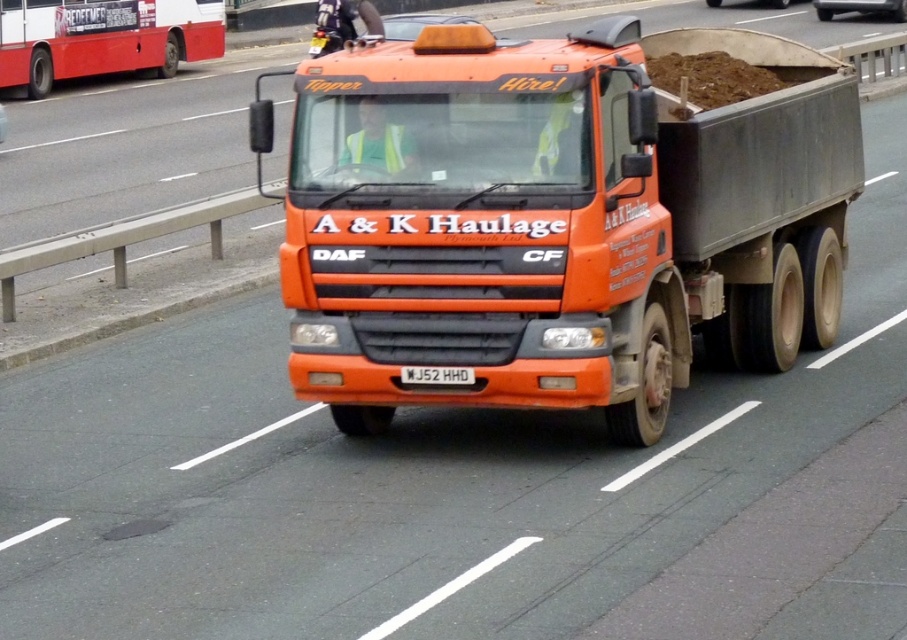
Question: Can you confirm if orange matte truck at center is positioned above white plastic license plate at center?

Choices:
 (A) no
 (B) yes

Answer: (B)

Question: Which of the following is the farthest from the observer?

Choices:
 (A) (467, 380)
 (B) (403, 160)

Answer: (B)

Question: Which point is closer to the camera?

Choices:
 (A) orange matte truck at center
 (B) white plastic license plate at center

Answer: (B)

Question: Does orange matte truck at center have a lesser width compared to white plastic license plate at center?

Choices:
 (A) no
 (B) yes

Answer: (A)

Question: Which point is farther from the camera taking this photo?

Choices:
 (A) (462, 378)
 (B) (361, 340)

Answer: (B)

Question: Can you confirm if orange matte truck at center is smaller than white plastic license plate at center?

Choices:
 (A) no
 (B) yes

Answer: (A)